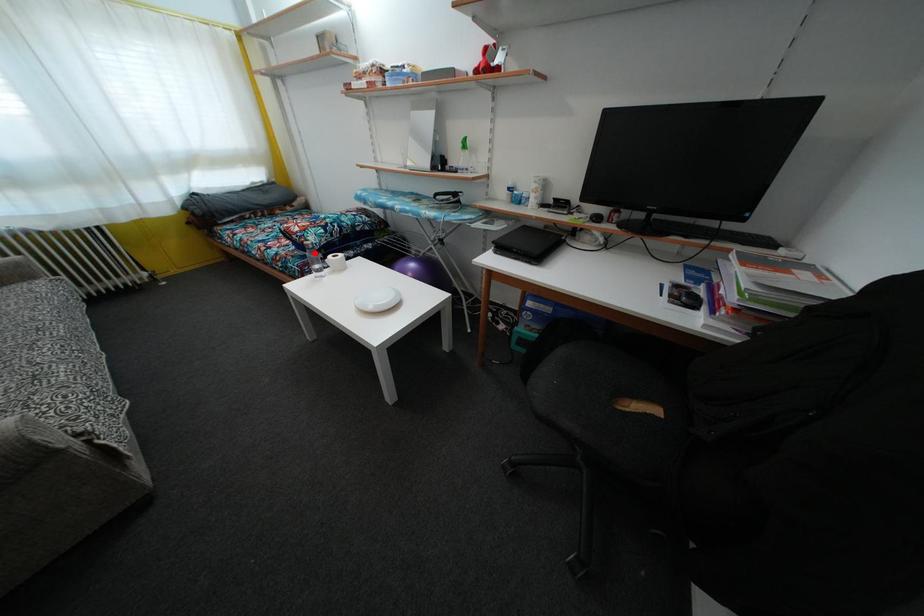
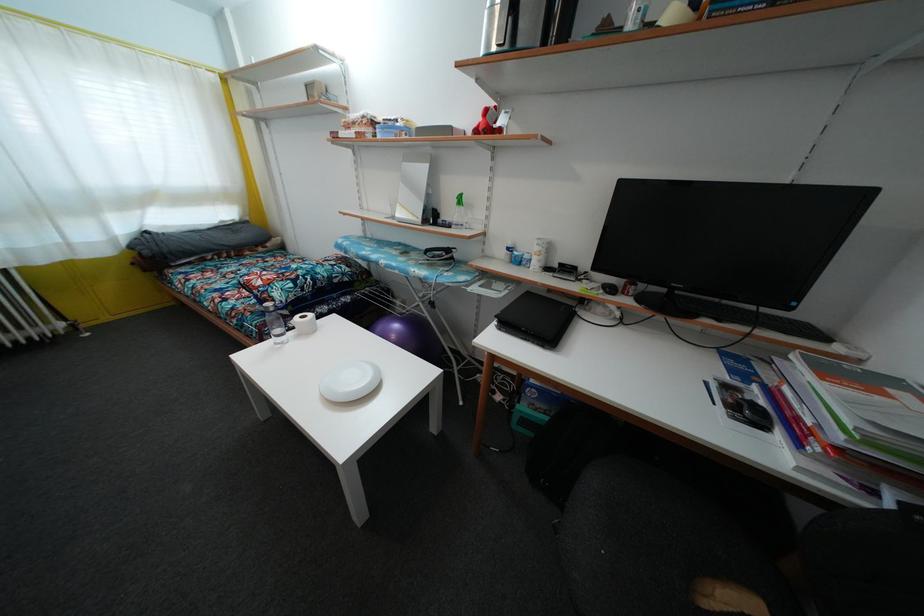
Where in the second image is the point corresponding to the highlighted location from the first image?

(275, 315)